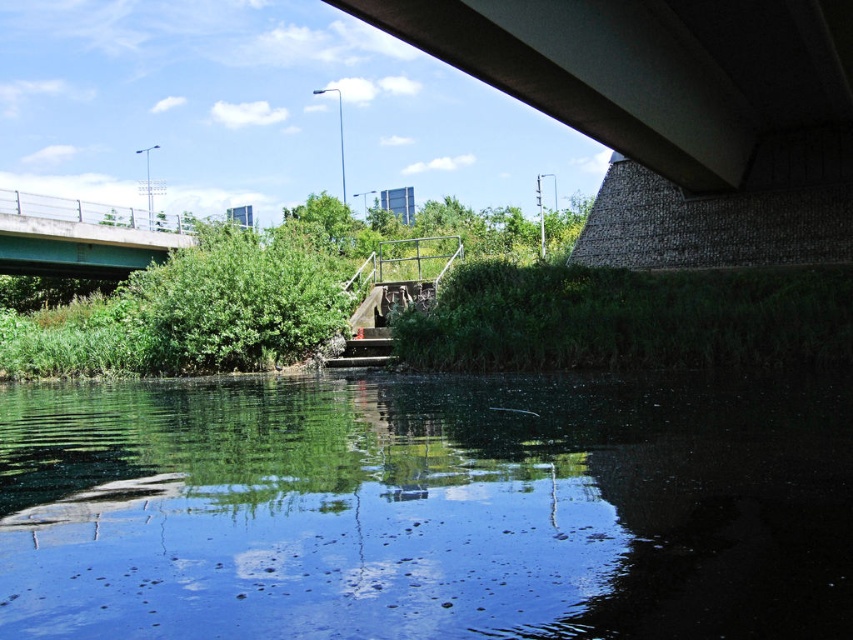
You are a diver preparing to jump into the water. The safety guidelines state that you must ensure the water depth is at least 4 meters before jumping. Based on the scene, can you confirm if the clear water at center is safe for your jump?

The clear water at center is 4.15 meters from camera, which meets the safety guideline requirement of at least 4 meters. Therefore, it is safe to jump into the clear water at center.

You are a swimmer looking to cross the water under the bridge. The green painted concrete bridge at upper left is above you. Where would you find the clear water at center in relation to the bridge?

The clear water at center is positioned under the green painted concrete bridge at upper left, so it is directly beneath the bridge.

You are a swimmer looking to cross the water. You see the clear water at center and the green painted concrete bridge at upper left. Which direction should you swim to reach the bridge?

The clear water at center is positioned on the right side of the green painted concrete bridge at upper left. To reach the bridge, you should swim to the left.